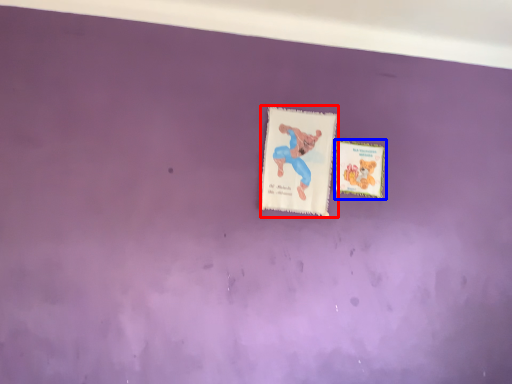
Question: Which object appears closest to the camera in this image, postcard (highlighted by a red box) or postcard (highlighted by a blue box)?

Choices:
 (A) postcard
 (B) postcard

Answer: (A)